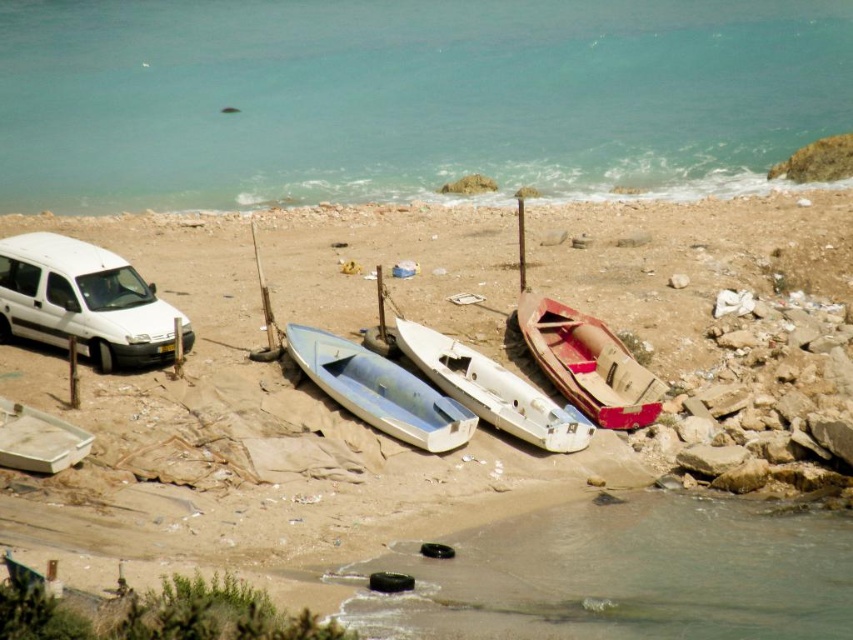
You are standing on the beach and see the wooden canoe at center and the white plastic canoe at center. Which one is covering the other?

The wooden canoe at center is positioned over the white plastic canoe at center, so it is covering the white plastic canoe at center.

You are standing at the point with coordinates 0.5, 0.5. You want to move to the metallic silver canoe at center. In which direction should you move? Please answer with either north, south, east, or west.

east